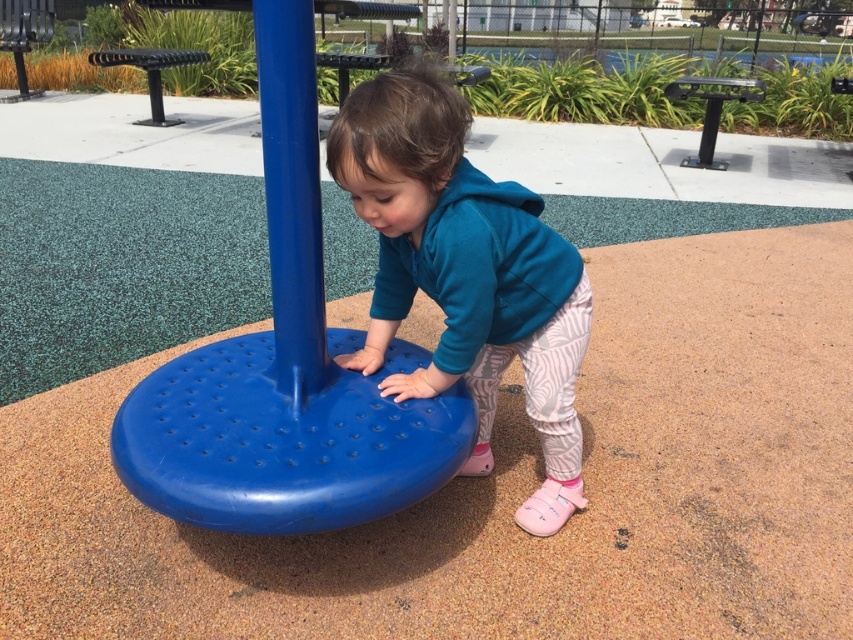
Consider the image. You are standing at the entrance of the playground and want to find the blue plastic platform at center. According to the coordinates provided, where should you look to locate it?

The blue plastic platform at center is located at the coordinates point [285,364], so you should look towards the center area of the playground to find it.

You are a parent supervising your child at the playground. You notice the blue plastic platform at center and the teal fleece jacket at center. Which object is positioned lower from the ground?

The blue plastic platform at center is located below the teal fleece jacket at center, so it is positioned lower from the ground.

You are a parent supervising your child at the playground. You see the teal fleece jacket at center and the blue plastic pole at center. Which object is positioned more to the right from your viewpoint?

The teal fleece jacket at center is positioned more to the right than the blue plastic pole at center.